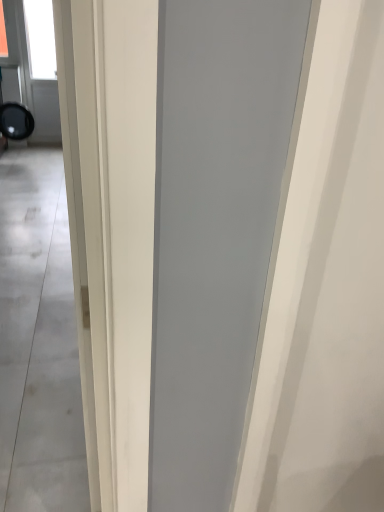
The width and height of the screenshot is (384, 512). What do you see at coordinates (38, 341) in the screenshot?
I see `matte white door at center` at bounding box center [38, 341].

You are a GUI agent. You are given a task and a screenshot of the screen. Output one action in this format:
    pyautogui.click(x=<x>, y=<y>)
    Task: Click on the matte white door at center
    This screenshot has height=512, width=384.
    Given the screenshot: What is the action you would take?
    pyautogui.click(x=38, y=341)

Locate an element on the screen. matte white door at center is located at coordinates click(x=38, y=341).